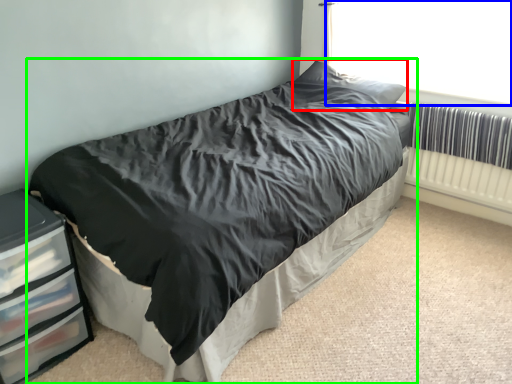
Question: Considering the real-world distances, which object is farthest from pillow (highlighted by a red box)? window screen (highlighted by a blue box) or bed (highlighted by a green box)?

Choices:
 (A) window screen
 (B) bed

Answer: (B)